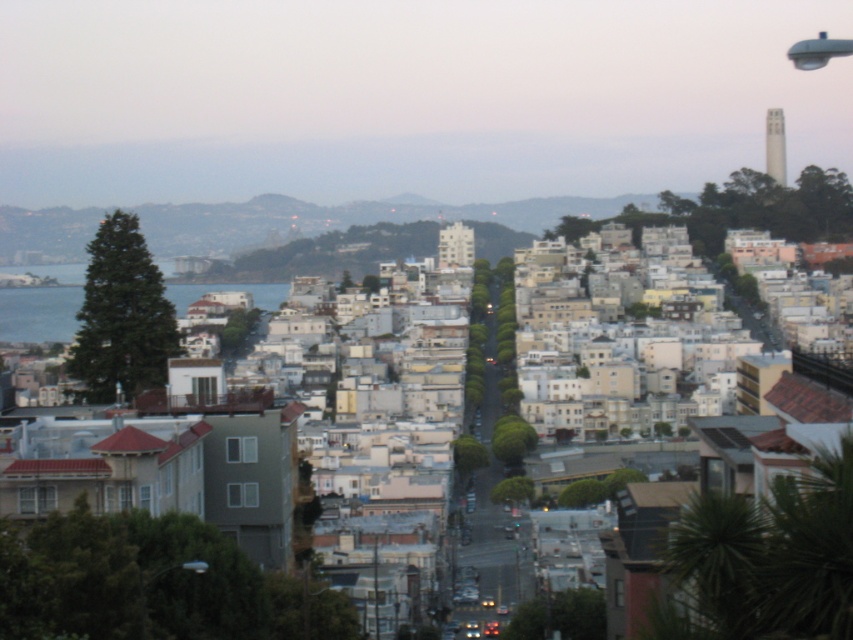
In the scene shown: You are a drone operator flying over the urban area. You need to capture a photo of both the green grassy hillside at center and the blue water at left. Which object should you position closer to the camera to ensure both are visible in the frame?

The green grassy hillside at center should be positioned closer to the camera because the blue water at left is behind it, so moving the drone closer to the hillside will keep both in view without the water being obscured.

You are a drone operator planning to fly a drone from the green grassy hillside at center to the blue water at left. Considering the spatial relationship between these two landmarks, will the drone need to ascend or descend during its flight path?

The green grassy hillside at center is taller than blue water at left, so the drone will need to descend during its flight path to reach the blue water at left.

You are standing at the point marked as point (341, 218) in the image. Based on the scene description, what type of terrain are you currently standing on?

The point (341, 218) is on green grassy hillside at center, so you are standing on a grassy hillside.